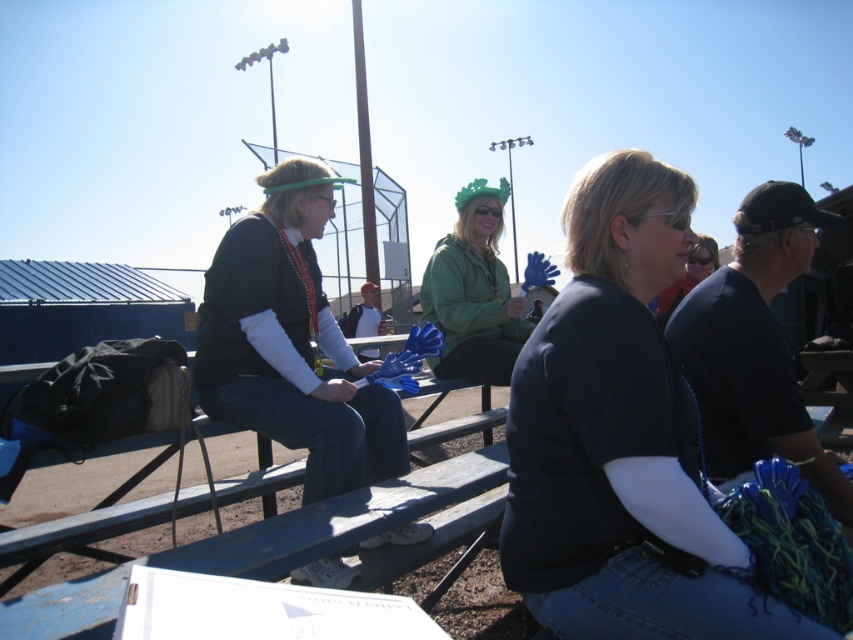
Question: Does matte black jacket at left have a larger size compared to green matte jacket at center?

Choices:
 (A) yes
 (B) no

Answer: (A)

Question: Among these objects, which one is farthest from the camera?

Choices:
 (A) dark blue jersey at center
 (B) green matte jacket at center

Answer: (B)

Question: Estimate the real-world distances between objects in this image. Which object is farther from the matte black jacket at left?

Choices:
 (A) dark blue jersey at center
 (B) green matte jacket at center

Answer: (B)

Question: Is dark blue jersey at center to the left of green matte jacket at center from the viewer's perspective?

Choices:
 (A) no
 (B) yes

Answer: (A)

Question: Which object is farther from the camera taking this photo?

Choices:
 (A) green matte jacket at center
 (B) matte black jacket at left

Answer: (A)

Question: Does matte black jacket at left have a larger size compared to green matte jacket at center?

Choices:
 (A) no
 (B) yes

Answer: (B)